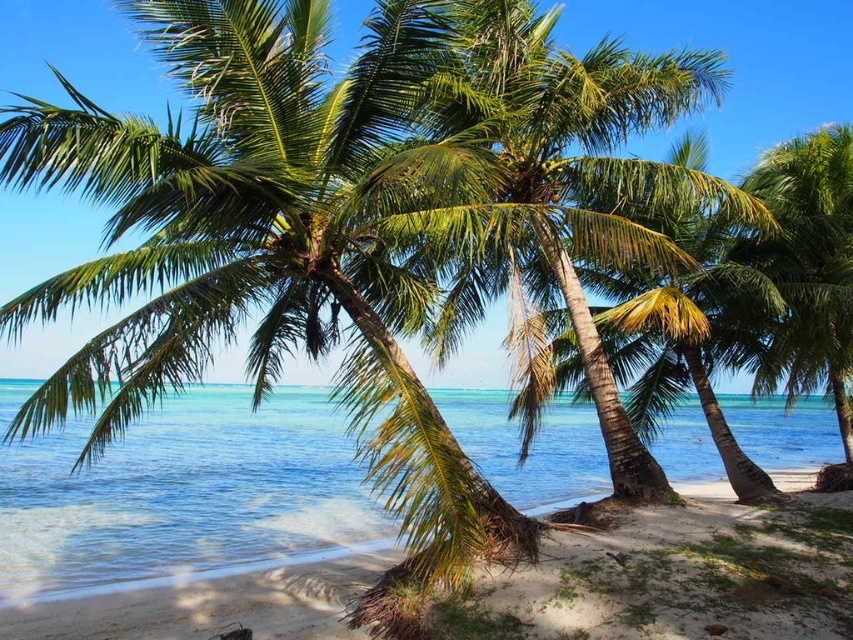
You are a photographer wanting to capture the clear blue water at center and the green leafy palm tree at right in a single shot. Based on their sizes in the image, which one will appear bigger in the photo?

The clear blue water at center will appear bigger in the photo because it has a larger size compared to the green leafy palm tree at right.

You are standing on the beach and want to walk to the clear blue water at center. Which direction should you head relative to the green leafy palm tree at right?

Since the clear blue water at center is positioned on the left side of green leafy palm tree at right, you should head towards the left side of the green leafy palm tree at right to reach the clear blue water at center.